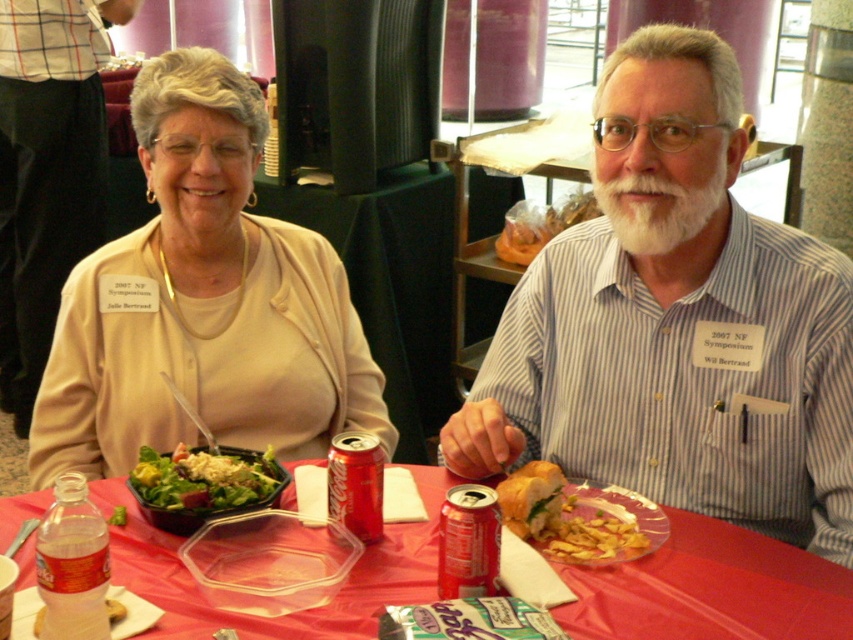
What is the 2D coordinate of the striped cotton shirt at center?

The striped cotton shirt at center is located at the 2D coordinate point of (676, 323).

You are organizing a photo shoot and need to ensure that all items on the table are visible in the frame. The striped cotton shirt at center and the fresh green salad at left are both on the table. Which item takes up more space on the table?

The striped cotton shirt at center takes up more space on the table because it is bigger than the fresh green salad at left.

Where is the fresh green salad at left located in the image?

The fresh green salad at left is located at point (204, 480) in the image.